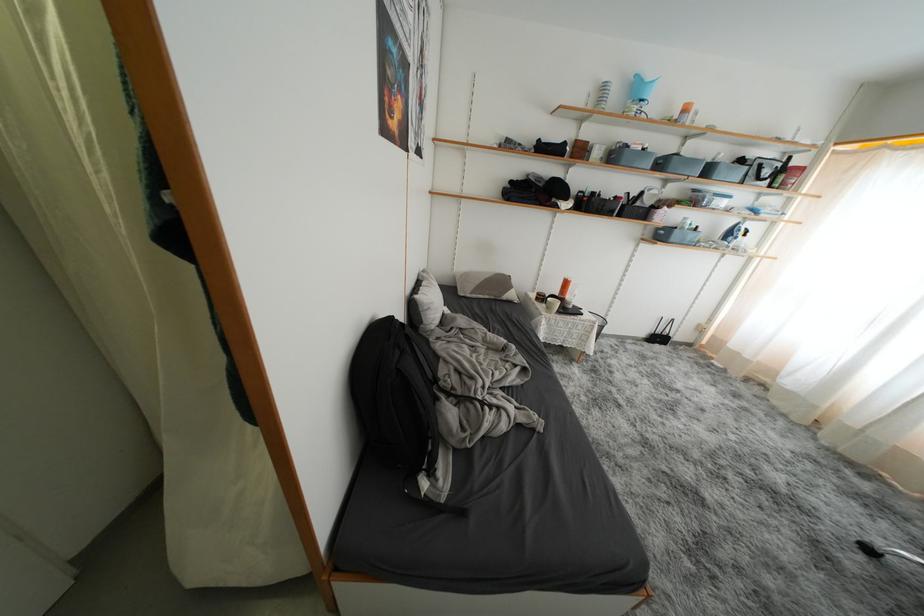
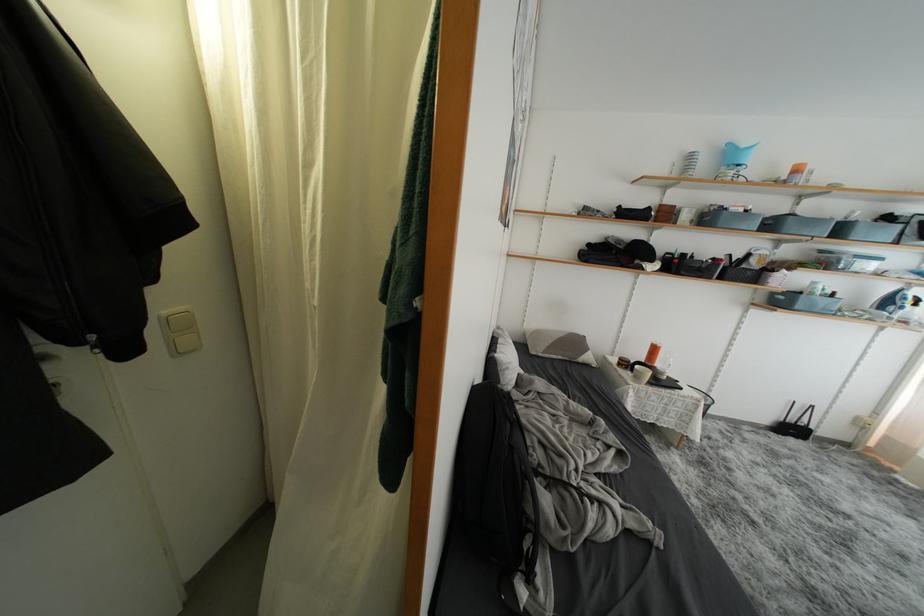
Where in the second image is the point corresponding to (x=664, y=342) from the first image?

(797, 434)